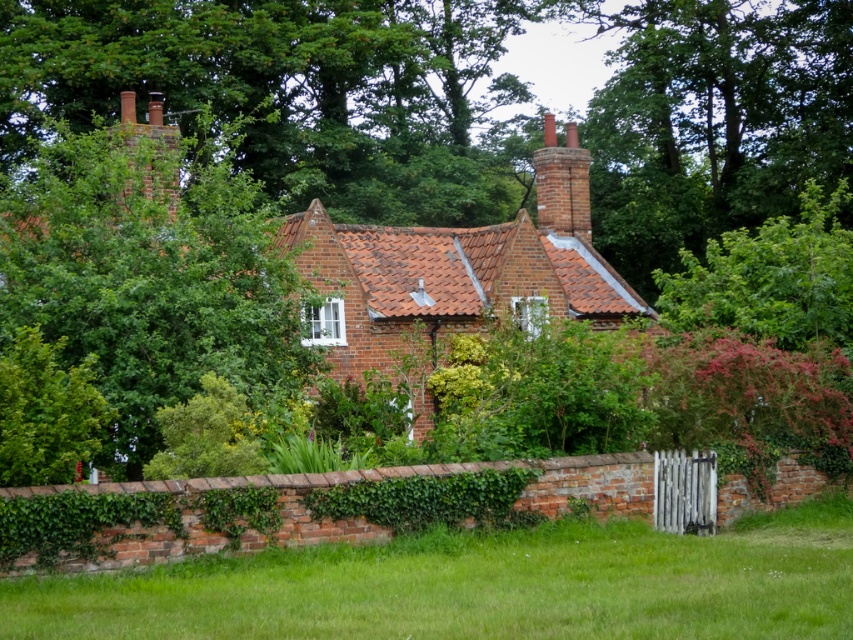
Question: Does brick cottage at center appear over green leafy hedge at lower left?

Choices:
 (A) no
 (B) yes

Answer: (B)

Question: Is green leafy tree at upper left behind green leafy hedge at lower left?

Choices:
 (A) yes
 (B) no

Answer: (B)

Question: Observing the image, what is the correct spatial positioning of brick cottage at center in reference to green leafy hedge at left?

Choices:
 (A) left
 (B) right

Answer: (B)

Question: Among these objects, which one is farthest from the camera?

Choices:
 (A) green leafy hedge at lower left
 (B) brick cottage at center
 (C) green leafy tree at upper left
 (D) green grass at lower center

Answer: (A)

Question: Which of the following is the farthest from the observer?

Choices:
 (A) (206, 440)
 (B) (125, 472)

Answer: (B)

Question: Which point appears farthest from the camera in this image?

Choices:
 (A) (283, 602)
 (B) (22, 221)
 (C) (39, 339)

Answer: (B)